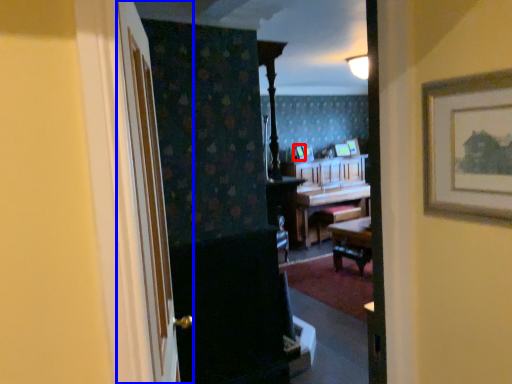
Question: Which point is further to the camera, picture frame (highlighted by a red box) or door (highlighted by a blue box)?

Choices:
 (A) picture frame
 (B) door

Answer: (A)